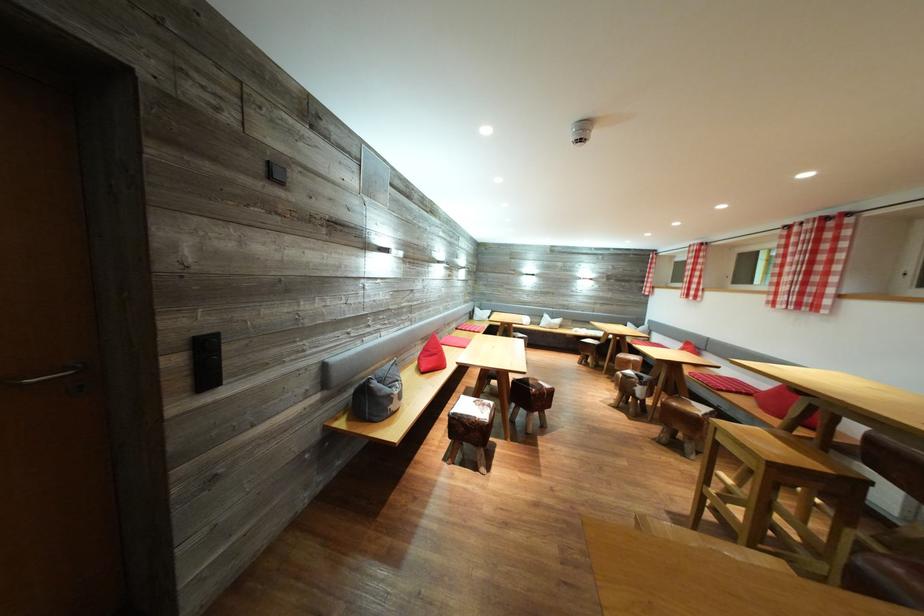
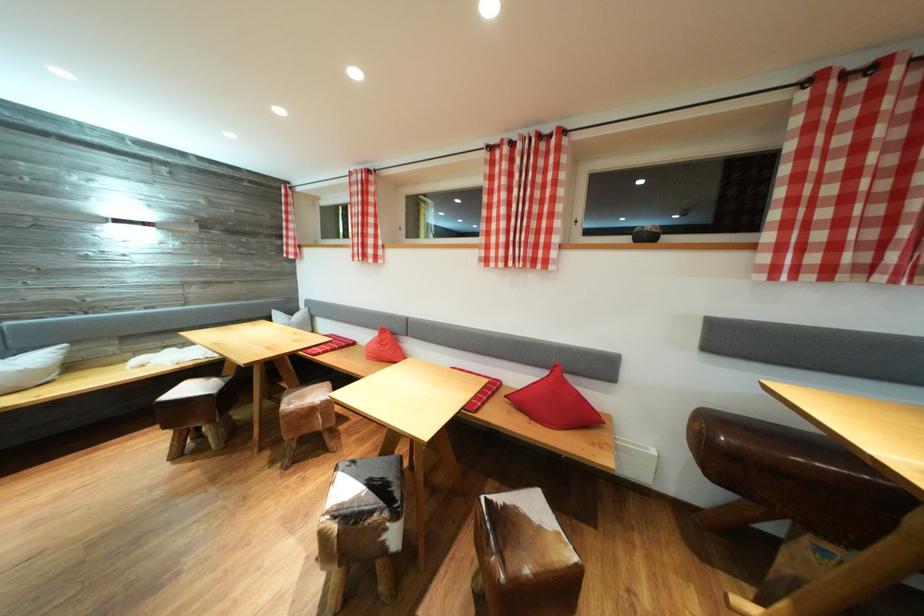
Find the pixel in the second image that matches the point at 636,367 in the first image.

(319, 416)